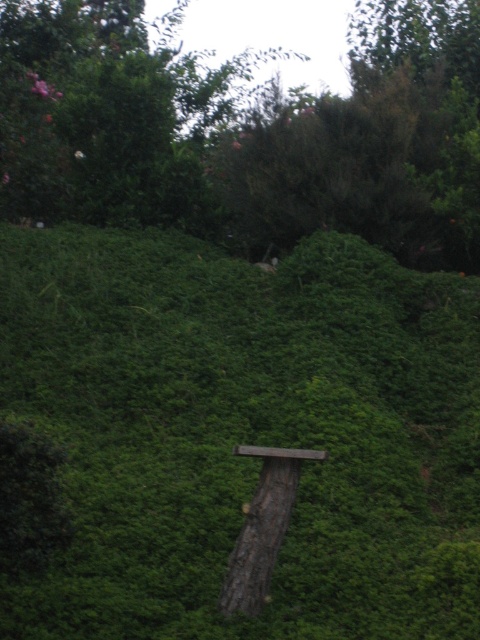
Does green leafy hedge at center appear on the right side of green leafy tree at center?

Yes, green leafy hedge at center is to the right of green leafy tree at center.

Identify the location of green leafy hedge at center. pyautogui.click(x=244, y=433).

Is green leafy tree at center bigger than brown rough tree trunk at center?

Indeed, green leafy tree at center has a larger size compared to brown rough tree trunk at center.

Which is below, green leafy tree at center or brown rough tree trunk at center?

Positioned lower is brown rough tree trunk at center.

This screenshot has width=480, height=640. Describe the element at coordinates (244, 131) in the screenshot. I see `green leafy tree at center` at that location.

Find the location of a particular element. The image size is (480, 640). green leafy tree at center is located at coordinates (244, 131).

Find the location of a particular element. The width and height of the screenshot is (480, 640). green leafy hedge at center is located at coordinates (244, 433).

The image size is (480, 640). Find the location of `green leafy hedge at center`. green leafy hedge at center is located at coordinates (244, 433).